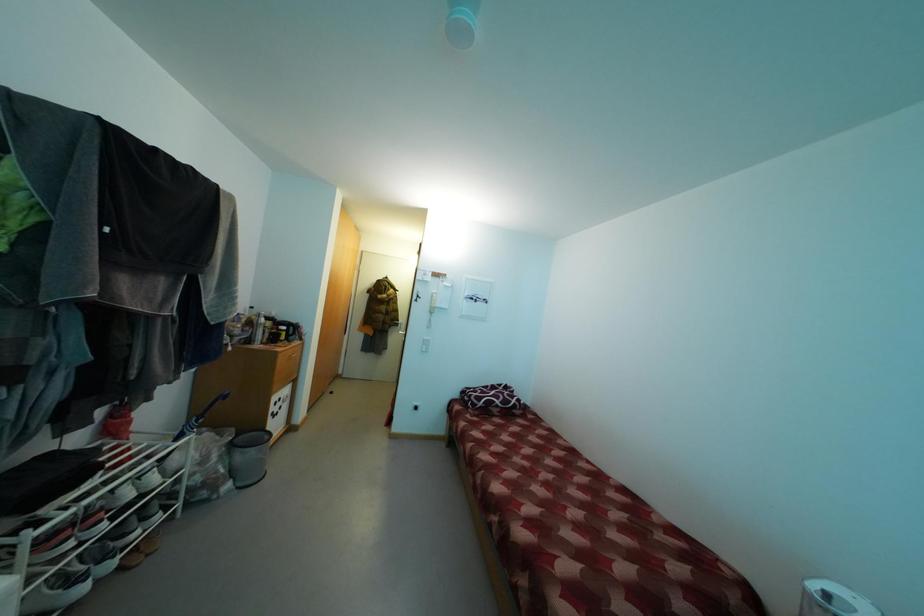
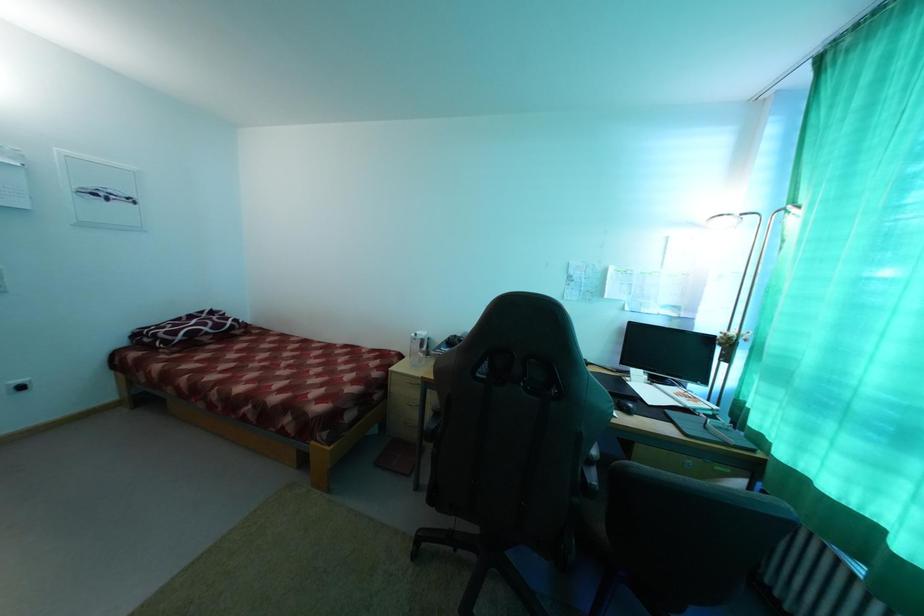
The first image is from the beginning of the video and the second image is from the end. How did the camera likely rotate when shooting the video?

The camera's rotation is toward right-down.